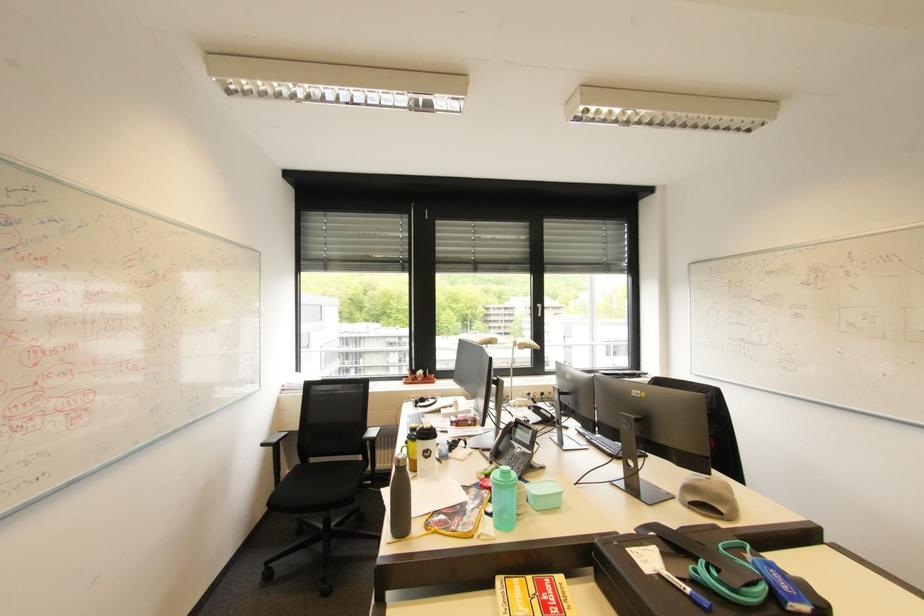
What do you see at coordinates (502, 445) in the screenshot?
I see `the black phone handset` at bounding box center [502, 445].